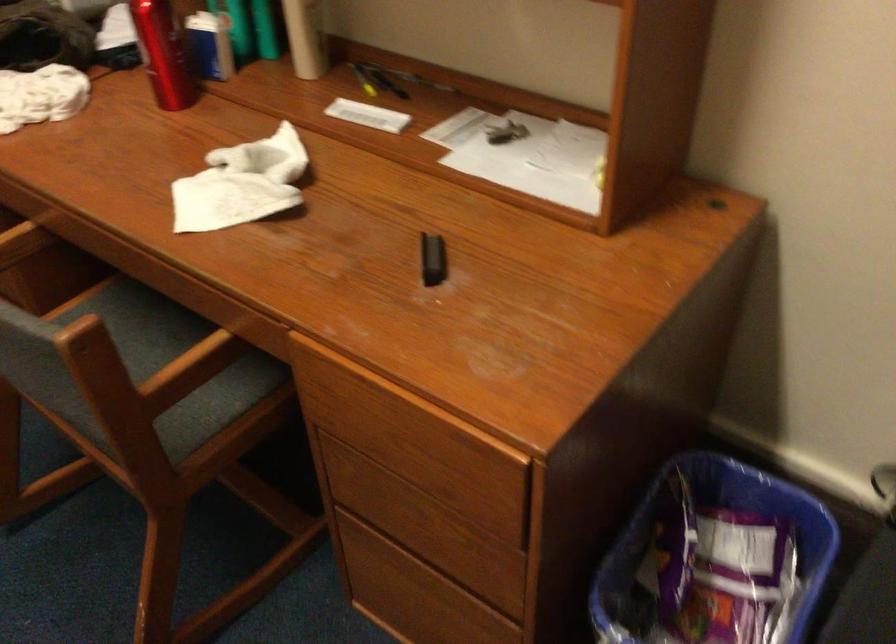
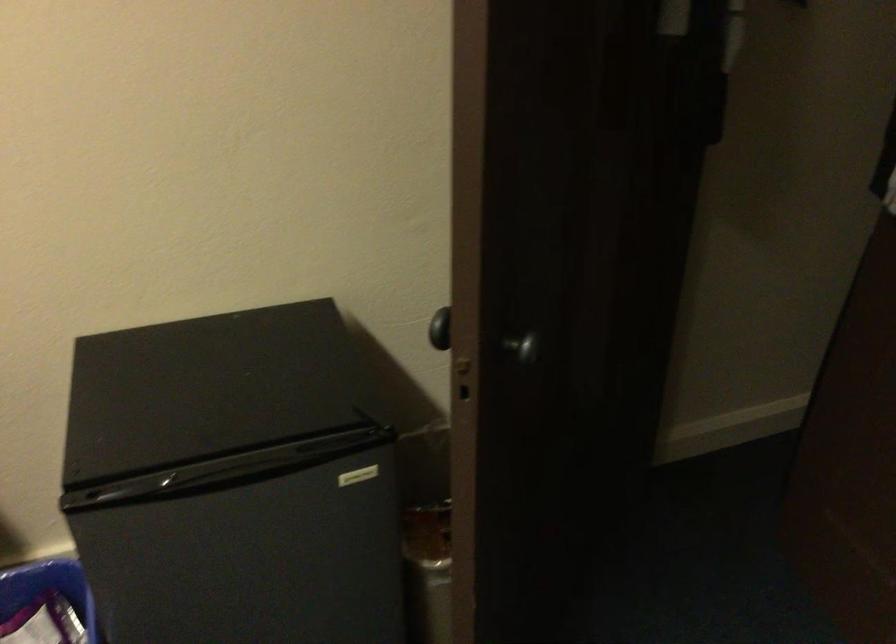
Question: The images are taken continuously from a first-person perspective. In which direction is your viewpoint rotating?

Choices:
 (A) Left
 (B) Right
 (C) Up
 (D) Down

Answer: (B)